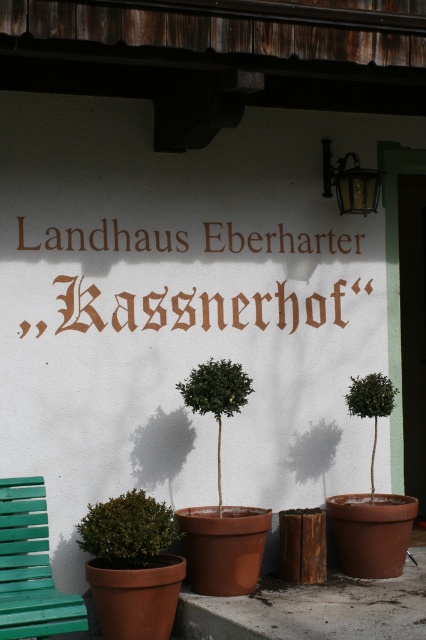
You are standing in front of the building shown in the image. There is a point marked at coordinate (x=127, y=531). Which object does this point correspond to?

The point at coordinate (x=127, y=531) corresponds to the green matte plant at lower left.

You are sitting on the green painted wood bench at lower left and want to look at the green matte tree at center. Which direction should you turn your head to see it?

You should turn your head to the right to see the green matte tree at center because the green painted wood bench at lower left is to the left of it.

You are standing in front of the building shown in the image. The green matte tree at center is part of the scene. If you want to take a closer look at the tree, how many steps should you take backward to ensure you can see the entire tree in your camera frame?

The green matte tree at center is 7.31 meters away from the camera. To ensure the entire tree fits in your camera frame, you should move backward to increase the distance. However, without knowing the camera specifications or the tree size, an exact number of steps can not be determined. Please adjust your position accordingly.